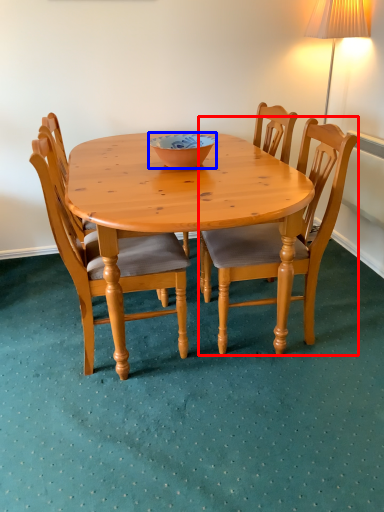
Question: Which object appears farthest to the camera in this image, chair (highlighted by a red box) or bowl (highlighted by a blue box)?

Choices:
 (A) chair
 (B) bowl

Answer: (B)